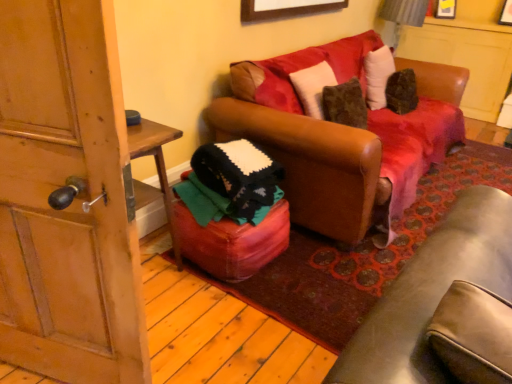
I want to click on empty space that is to the right of leather ottoman at center, so click(314, 264).